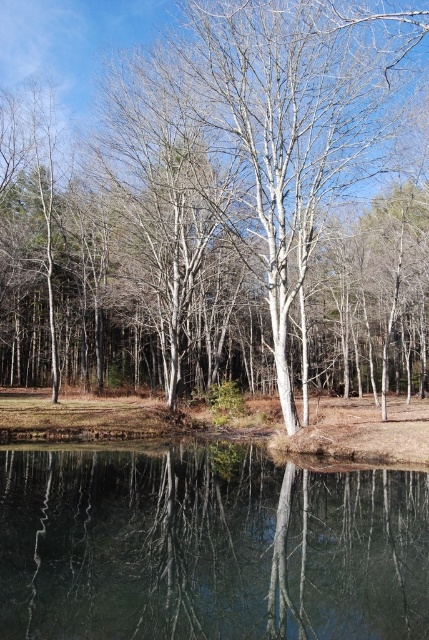
Is point (344, 179) positioned in front of point (242, 465)?

No, (344, 179) is behind (242, 465).

Who is taller, smooth white tree at center or clear glass water at center?

With more height is smooth white tree at center.

Which is in front, point (88, 234) or point (229, 545)?

Point (229, 545)

You are a GUI agent. You are given a task and a screenshot of the screen. Output one action in this format:
    pyautogui.click(x=<x>, y=<y>)
    Task: Click on the smooth white tree at center
    The width and height of the screenshot is (429, 640).
    Given the screenshot: What is the action you would take?
    pyautogui.click(x=220, y=209)